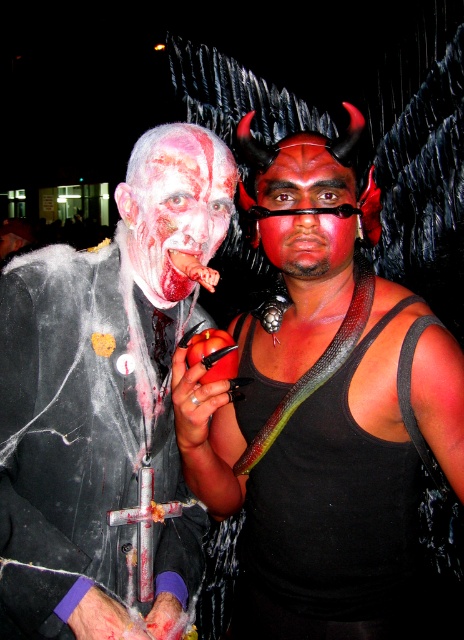
You are a photographer at a costume party. You need to take a portrait of the person dressed as a zombie. The zombie has two key features on their face that you want to highlight in the photo. The first is the bloody flesh at center and the second is the matte red face paint at center. Since you want both features to be clearly visible, which feature should you focus on to ensure proper depth of field?

The bloody flesh at center is much taller than the matte red face paint at center, so focusing on the bloody flesh at center will ensure both features are in focus because it is the farther one from the camera.